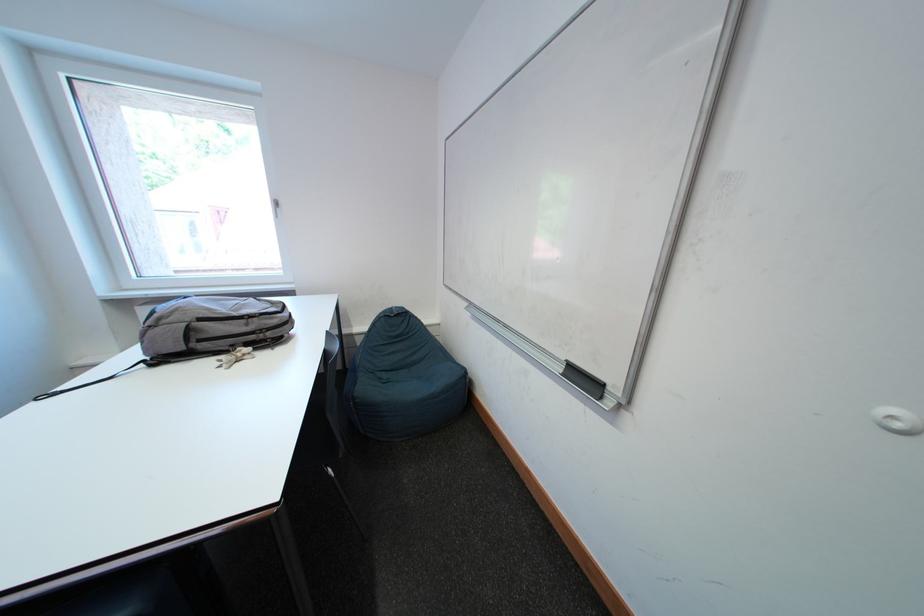
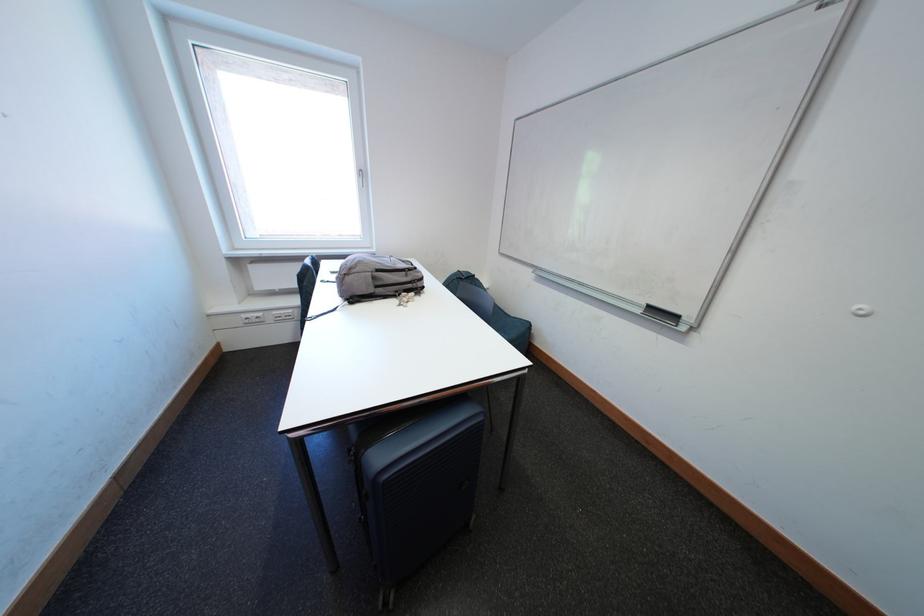
The point at (x=241, y=349) is marked in the first image. Where is the corresponding point in the second image?

(406, 294)